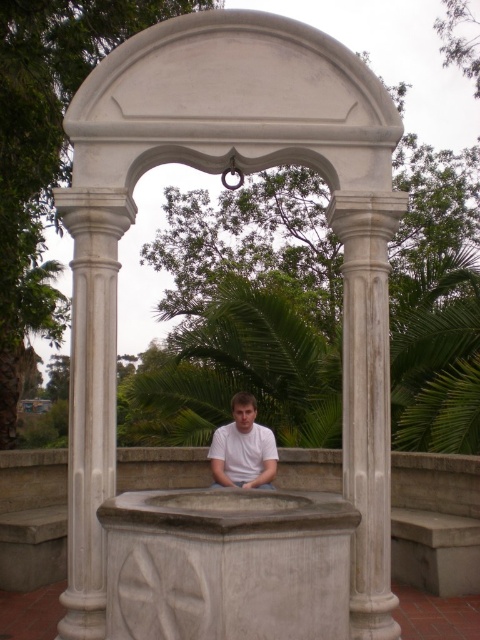
Is white marble pillar at center taller than white matte shirt at center?

Indeed, white marble pillar at center has a greater height compared to white matte shirt at center.

Can you confirm if white marble pillar at center is smaller than white matte shirt at center?

Actually, white marble pillar at center might be larger than white matte shirt at center.

Image resolution: width=480 pixels, height=640 pixels. What do you see at coordinates (216, 172) in the screenshot?
I see `white marble pillar at center` at bounding box center [216, 172].

Identify the location of white marble pillar at center. The width and height of the screenshot is (480, 640). (216, 172).

Who is more forward, (x=312, y=99) or (x=359, y=220)?

Point (x=359, y=220)

Who is higher up, white marble pillar at center or white marble column at center?

white marble pillar at center

Does point (251, 16) lie behind point (336, 193)?

Yes, it is.

At what (x,y) coordinates should I click in order to perform the action: click on white marble pillar at center. Please return your answer as a coordinate pair (x, y). Looking at the image, I should click on (216, 172).

Between white marble pillar at center and white marble column at left, which one has more height?

Standing taller between the two is white marble pillar at center.

Who is higher up, white marble pillar at center or white marble column at left?

white marble pillar at center is higher up.

Between point (147, 147) and point (113, 451), which one is positioned in front?

Point (113, 451)

Where is `white marble pillar at center`? The width and height of the screenshot is (480, 640). white marble pillar at center is located at coordinates (216, 172).